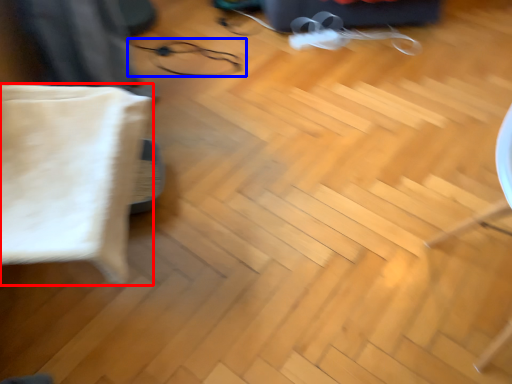
Question: Which of the following is the farthest to the observer, pillow (highlighted by a red box) or glasses (highlighted by a blue box)?

Choices:
 (A) pillow
 (B) glasses

Answer: (B)